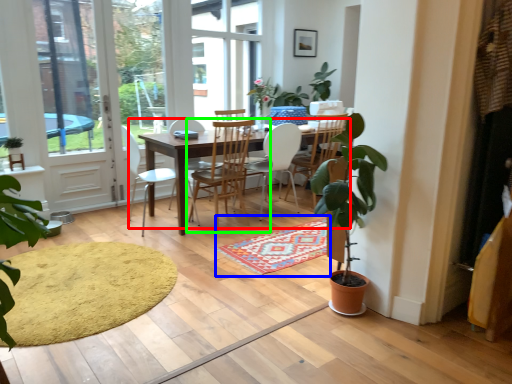
Question: Which object is the farthest from kitchen & dining room table (highlighted by a red box)? Choose among these: doormat (highlighted by a blue box) or chair (highlighted by a green box).

Choices:
 (A) doormat
 (B) chair

Answer: (A)